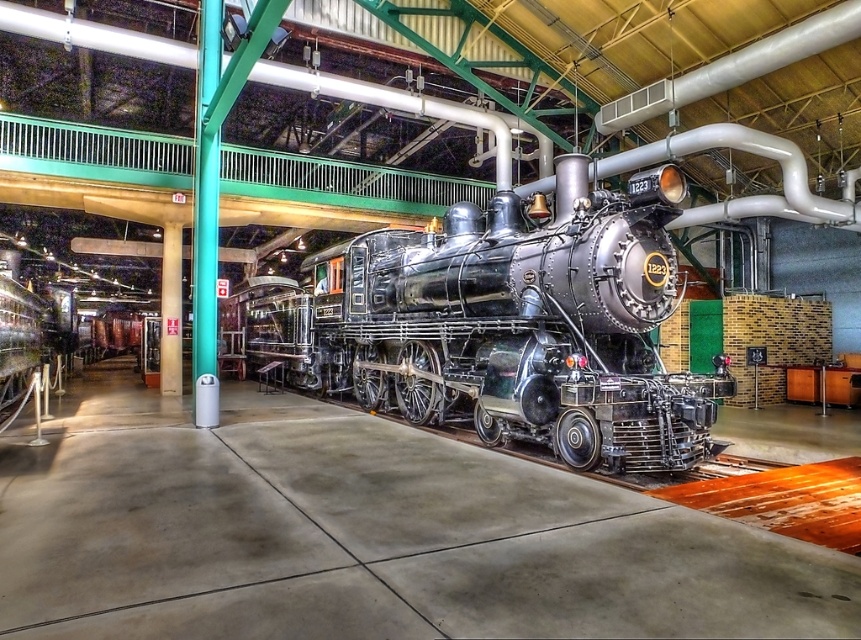
Which is behind, point (568, 307) or point (208, 90)?

Point (208, 90)

From the picture: Is polished steel steam locomotive at center to the right of teal glossy pole at center from the viewer's perspective?

Correct, you'll find polished steel steam locomotive at center to the right of teal glossy pole at center.

Is point (412, 296) in front of point (202, 305)?

No, (412, 296) is behind (202, 305).

At what (x,y) coordinates should I click in order to perform the action: click on polished steel steam locomotive at center. Please return your answer as a coordinate pair (x, y). Image resolution: width=861 pixels, height=640 pixels. Looking at the image, I should click on (523, 326).

What do you see at coordinates (206, 218) in the screenshot?
I see `teal glossy pole at center` at bounding box center [206, 218].

Is point (208, 337) positioned behind point (686, 132)?

No, (208, 337) is in front of (686, 132).

You are a GUI agent. You are given a task and a screenshot of the screen. Output one action in this format:
    pyautogui.click(x=<x>, y=<y>)
    Task: Click on the teal glossy pole at center
    The height and width of the screenshot is (640, 861).
    Given the screenshot: What is the action you would take?
    pyautogui.click(x=206, y=218)

What do you see at coordinates (523, 326) in the screenshot? Image resolution: width=861 pixels, height=640 pixels. I see `polished steel steam locomotive at center` at bounding box center [523, 326].

Is polished steel steam locomotive at center closer to the viewer compared to matte silver pipe at center?

Yes, polished steel steam locomotive at center is in front of matte silver pipe at center.

Identify the location of polished steel steam locomotive at center. This screenshot has height=640, width=861. coord(523,326).